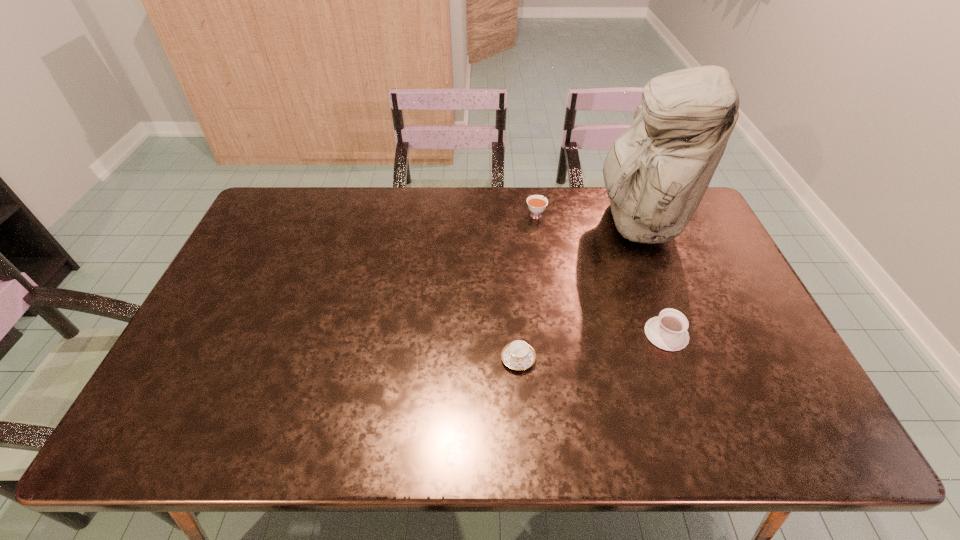
Find the location of `free point at the near edge`. free point at the near edge is located at coordinates (470, 418).

The width and height of the screenshot is (960, 540). In order to click on free space at the left edge of the desktop in this screenshot , I will do `click(223, 376)`.

In the image, there is a desktop. Where is `vacant space at the right edge`? The image size is (960, 540). vacant space at the right edge is located at coordinates (686, 265).

The width and height of the screenshot is (960, 540). I want to click on vacant area at the far left corner, so click(305, 200).

You are a GUI agent. You are given a task and a screenshot of the screen. Output one action in this format:
    pyautogui.click(x=<x>, y=<y>)
    Task: Click on the vacant position at the near right corner of the desktop
    The image size is (960, 540).
    Given the screenshot: What is the action you would take?
    pyautogui.click(x=786, y=436)

Locate an element on the screen. The width and height of the screenshot is (960, 540). free space that is in between the leftmost object and the third object from right to left is located at coordinates click(527, 287).

Find the location of a particular element. free area in between the second teacup from left to right and the rightmost teacup is located at coordinates 601,274.

What are the coordinates of `vacant area that lies between the shortest teacup and the rightmost teacup` in the screenshot? It's located at (592, 347).

This screenshot has height=540, width=960. What are the coordinates of `vacant area that lies between the rightmost teacup and the third object from right to left` in the screenshot? It's located at (601, 274).

This screenshot has height=540, width=960. I want to click on free space between the rightmost teacup and the second teacup from left to right, so click(601, 274).